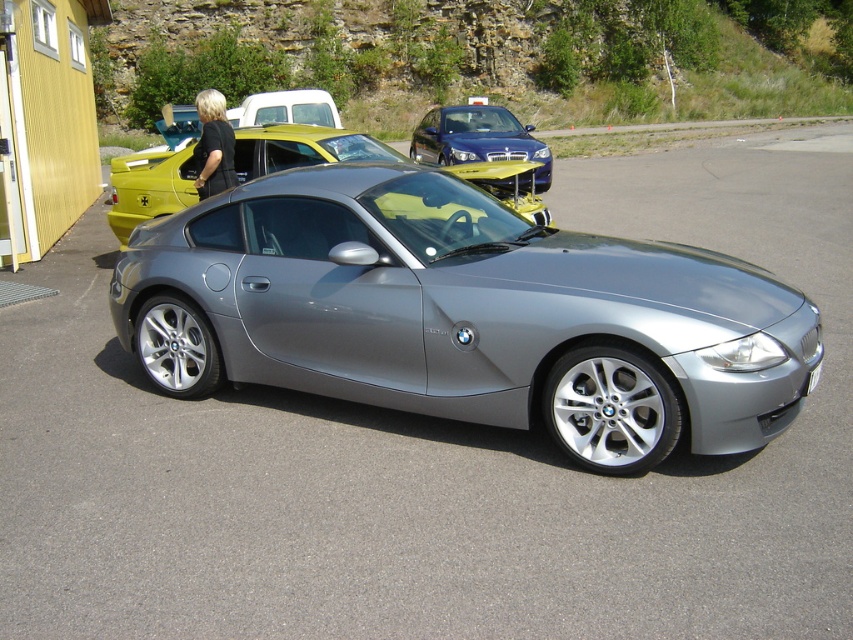
Question: Among these objects, which one is nearest to the camera?

Choices:
 (A) satin silver car at center
 (B) white plastic license plate at center
 (C) metallic silver car at center
 (D) white matte van at upper center

Answer: (A)

Question: Does satin silver car at center have a smaller size compared to metallic silver car at center?

Choices:
 (A) yes
 (B) no

Answer: (B)

Question: Estimate the real-world distances between objects in this image. Which object is farther from the white matte van at upper center?

Choices:
 (A) white plastic license plate at center
 (B) satin silver car at center

Answer: (B)

Question: Is satin silver car at center positioned behind metallic blue sedan at center?

Choices:
 (A) no
 (B) yes

Answer: (A)

Question: Which object is closer to the camera taking this photo?

Choices:
 (A) white matte van at upper center
 (B) satin silver car at center

Answer: (B)

Question: Observing the image, what is the correct spatial positioning of satin silver car at center in reference to black plastic license plate at lower center?

Choices:
 (A) below
 (B) above

Answer: (B)